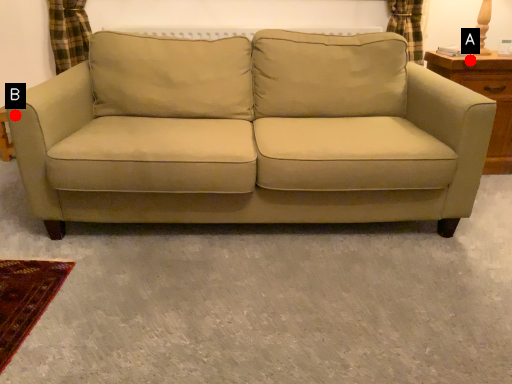
Question: Two points are circled on the image, labeled by A and B beside each circle. Which point is closer to the camera?

Choices:
 (A) A is closer
 (B) B is closer

Answer: (B)